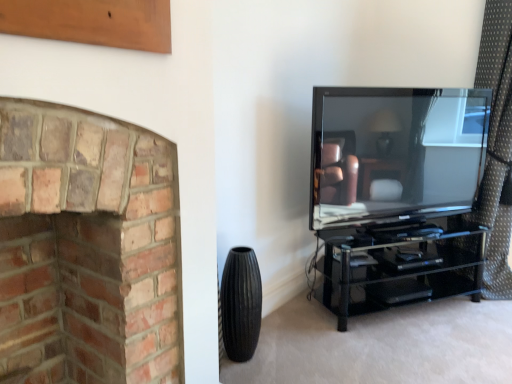
Question: Does black ribbed vase at lower center lie behind matte black tv at right?

Choices:
 (A) no
 (B) yes

Answer: (A)

Question: Is black ribbed vase at lower center wider than matte black tv at right?

Choices:
 (A) no
 (B) yes

Answer: (A)

Question: Considering the relative sizes of black ribbed vase at lower center and matte black tv at right in the image provided, is black ribbed vase at lower center smaller than matte black tv at right?

Choices:
 (A) yes
 (B) no

Answer: (A)

Question: Does black ribbed vase at lower center turn towards matte black tv at right?

Choices:
 (A) no
 (B) yes

Answer: (A)

Question: Is black ribbed vase at lower center with matte black tv at right?

Choices:
 (A) no
 (B) yes

Answer: (A)

Question: Are black ribbed vase at lower center and matte black tv at right far apart?

Choices:
 (A) no
 (B) yes

Answer: (A)

Question: Is red brick fireplace at left bigger than matte black tv at right?

Choices:
 (A) no
 (B) yes

Answer: (B)

Question: From a real-world perspective, is red brick fireplace at left below matte black tv at right?

Choices:
 (A) no
 (B) yes

Answer: (B)

Question: Does red brick fireplace at left have a greater height compared to matte black tv at right?

Choices:
 (A) no
 (B) yes

Answer: (B)

Question: Is red brick fireplace at left oriented away from matte black tv at right?

Choices:
 (A) no
 (B) yes

Answer: (A)

Question: Is red brick fireplace at left completely or partially outside of matte black tv at right?

Choices:
 (A) yes
 (B) no

Answer: (A)

Question: Can matte black tv at right be found inside red brick fireplace at left?

Choices:
 (A) no
 (B) yes

Answer: (A)

Question: Is matte black tv at right positioned far away from red brick fireplace at left?

Choices:
 (A) no
 (B) yes

Answer: (B)